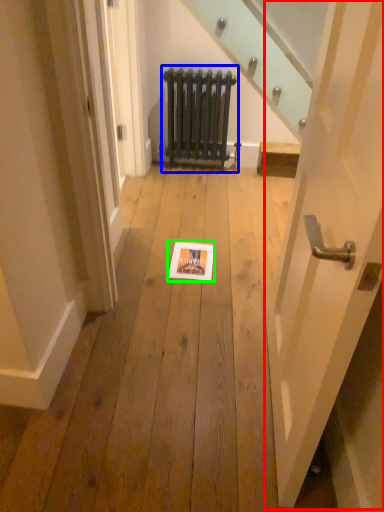
Question: Estimate the real-world distances between objects in this image. Which object is closer to door (highlighted by a red box), radiator (highlighted by a blue box) or picture frame (highlighted by a green box)?

Choices:
 (A) radiator
 (B) picture frame

Answer: (B)